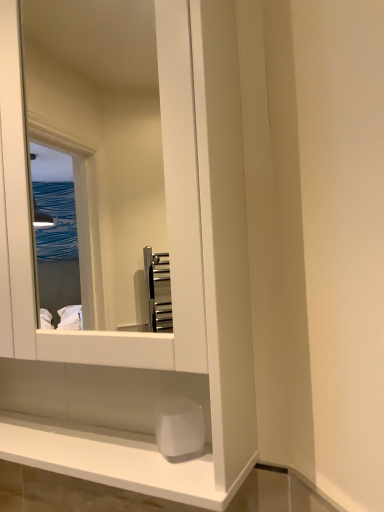
Question: Is white glossy mirror at center completely or partially outside of white matte soap at lower center?

Choices:
 (A) no
 (B) yes

Answer: (B)

Question: Is white glossy mirror at center thinner than white matte soap at lower center?

Choices:
 (A) yes
 (B) no

Answer: (B)

Question: Is white glossy mirror at center at the left side of white matte soap at lower center?

Choices:
 (A) yes
 (B) no

Answer: (A)

Question: Does white glossy mirror at center appear on the right side of white matte soap at lower center?

Choices:
 (A) no
 (B) yes

Answer: (A)

Question: Is white glossy mirror at center facing away from white matte soap at lower center?

Choices:
 (A) yes
 (B) no

Answer: (A)

Question: Is white glossy mirror at center further to the viewer compared to white matte soap at lower center?

Choices:
 (A) yes
 (B) no

Answer: (B)

Question: Is the depth of white matte soap at lower center greater than that of white glossy mirror at center?

Choices:
 (A) yes
 (B) no

Answer: (A)

Question: From a real-world perspective, is white matte soap at lower center beneath white glossy mirror at center?

Choices:
 (A) yes
 (B) no

Answer: (A)

Question: Is white matte soap at lower center facing towards white glossy mirror at center?

Choices:
 (A) no
 (B) yes

Answer: (B)

Question: Is white matte soap at lower center facing away from white glossy mirror at center?

Choices:
 (A) no
 (B) yes

Answer: (B)

Question: Is white matte soap at lower center taller than white glossy mirror at center?

Choices:
 (A) no
 (B) yes

Answer: (A)

Question: Is white matte soap at lower center far from white glossy mirror at center?

Choices:
 (A) no
 (B) yes

Answer: (B)

Question: Is white glossy mirror at center wider or thinner than white matte soap at lower center?

Choices:
 (A) wide
 (B) thin

Answer: (A)